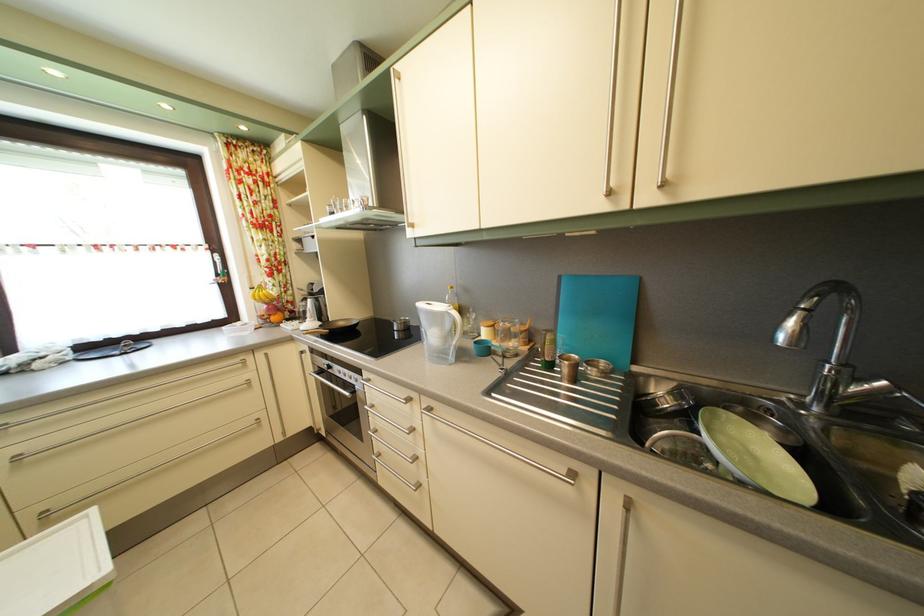
You are a GUI agent. You are given a task and a screenshot of the screen. Output one action in this format:
    pyautogui.click(x=<x>, y=<y>)
    Task: Click on the pan handle
    The image size is (924, 616).
    Given the screenshot: What is the action you would take?
    pyautogui.click(x=310, y=325)